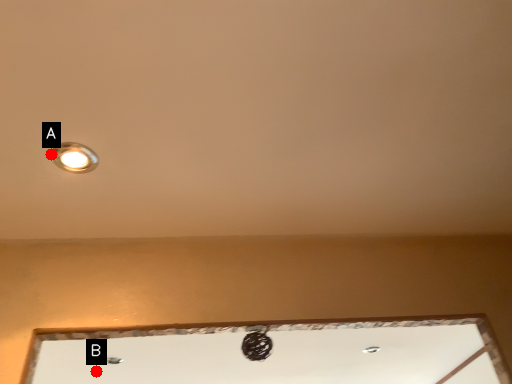
Question: Two points are circled on the image, labeled by A and B beside each circle. Which point is closer to the camera taking this photo?

Choices:
 (A) A is closer
 (B) B is closer

Answer: (A)